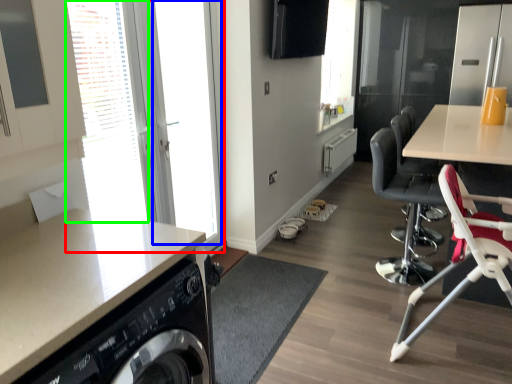
Question: Based on their relative distances, which object is farther from window (highlighted by a red box)? Choose from window screen (highlighted by a blue box) and window (highlighted by a green box).

Choices:
 (A) window screen
 (B) window

Answer: (B)